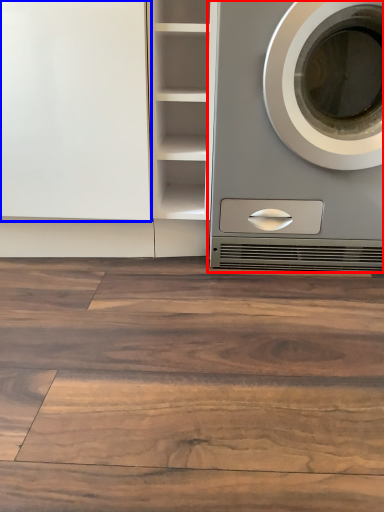
Question: Which object appears closest to the camera in this image, washing machine (highlighted by a red box) or glass door (highlighted by a blue box)?

Choices:
 (A) washing machine
 (B) glass door

Answer: (A)